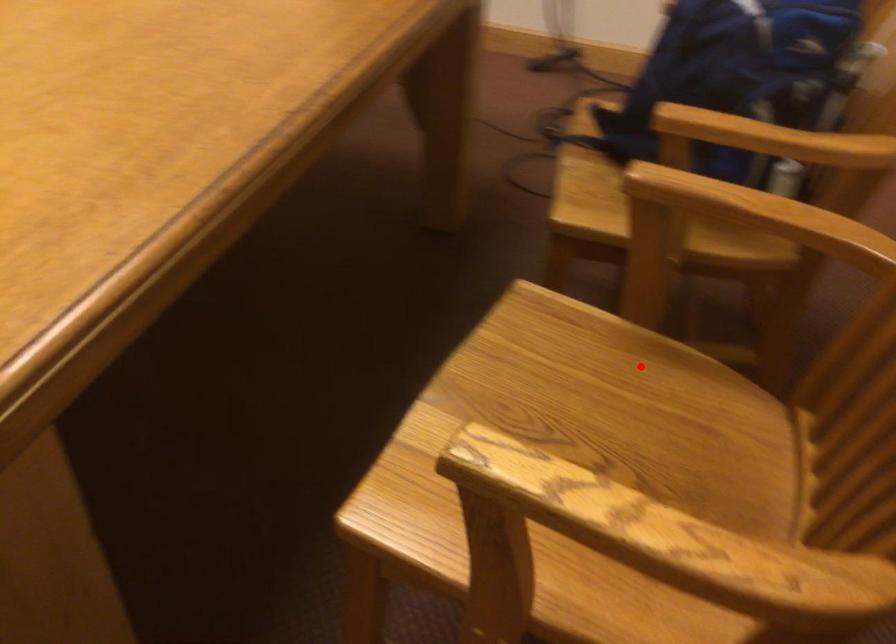
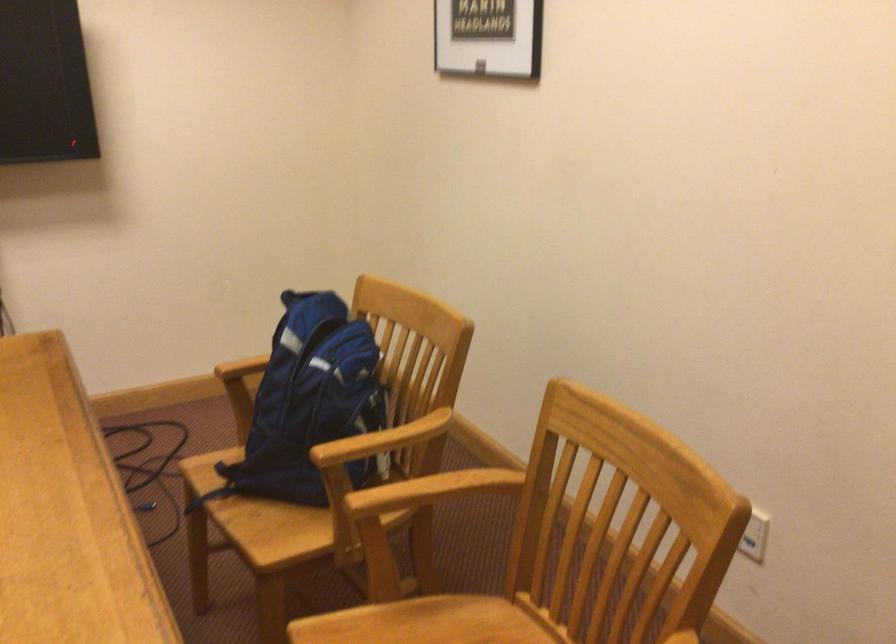
Locate, in the second image, the point that corresponds to the highlighted location in the first image.

(415, 627)